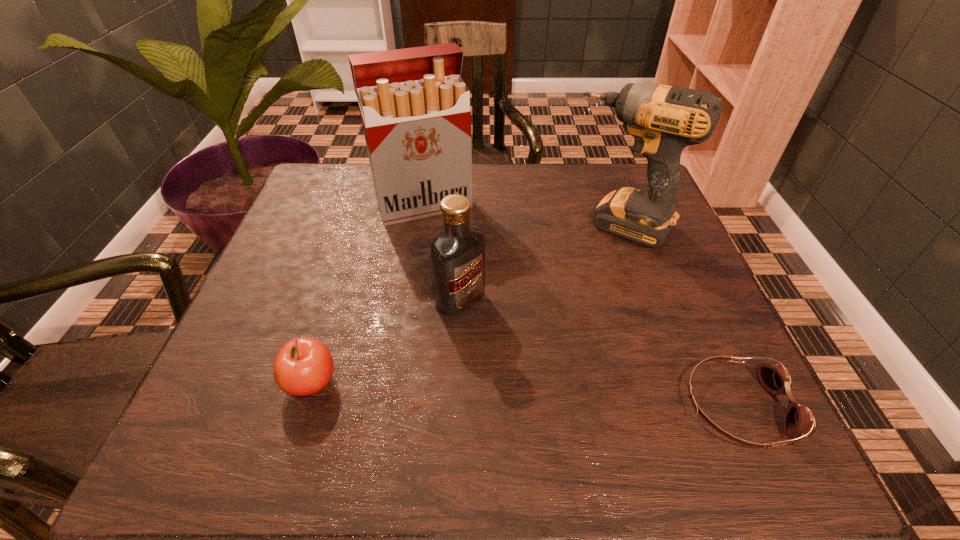
Identify the location of vacant area situated with the drill bit of the drill facing forward. click(547, 329).

Where is `vacant area situated 0.290m with the drill bit of the drill facing forward`? Image resolution: width=960 pixels, height=540 pixels. vacant area situated 0.290m with the drill bit of the drill facing forward is located at coordinates (545, 333).

I want to click on vacant area located 0.220m with the drill bit of the drill facing forward, so click(x=561, y=309).

This screenshot has width=960, height=540. I want to click on vacant space located on the front-facing side of the vodka, so click(522, 355).

Find the location of a particular element. The width and height of the screenshot is (960, 540). free region located 0.240m on the front-facing side of the vodka is located at coordinates (568, 396).

This screenshot has height=540, width=960. What are the coordinates of `vacant space situated 0.230m on the front-facing side of the vodka` in the screenshot? It's located at (564, 392).

You are a GUI agent. You are given a task and a screenshot of the screen. Output one action in this format:
    pyautogui.click(x=<x>, y=<y>)
    Task: Click on the cigarette case present at the far edge
    
    Given the screenshot: What is the action you would take?
    point(415,108)

Where is `drill that is positioned at the far edge`? drill that is positioned at the far edge is located at coordinates (663, 120).

Locate an element on the screen. apple positioned at the near edge is located at coordinates (303, 366).

Identify the location of goggles that is at the near edge. (799, 420).